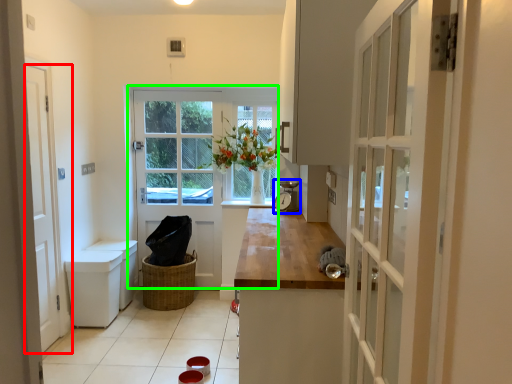
Question: Based on their relative distances, which object is farther from door (highlighted by a red box)? Choose from appliance (highlighted by a blue box) and door (highlighted by a green box).

Choices:
 (A) appliance
 (B) door

Answer: (A)